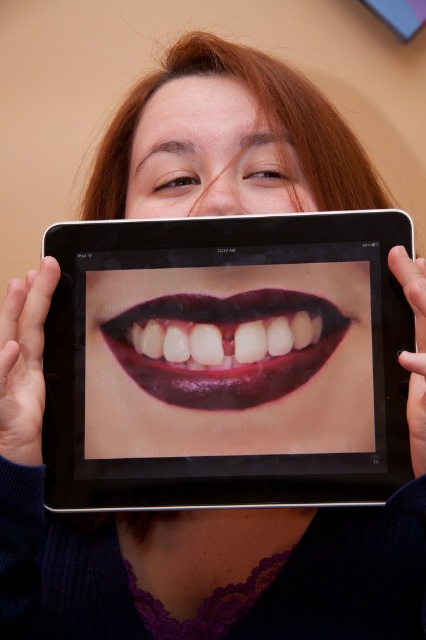
Question: Among these objects, which one is nearest to the camera?

Choices:
 (A) smooth skin at center
 (B) black glossy tablet at center

Answer: (B)

Question: Does shiny dark red lips at center have a lesser width compared to smooth skin at center?

Choices:
 (A) yes
 (B) no

Answer: (A)

Question: Is black glossy tablet at center positioned in front of shiny dark red lips at center?

Choices:
 (A) yes
 (B) no

Answer: (A)

Question: Does black glossy tablet at center come in front of shiny dark red lips at center?

Choices:
 (A) yes
 (B) no

Answer: (A)

Question: Which of the following is the closest to the observer?

Choices:
 (A) smooth skin at center
 (B) black glossy tablet at center
 (C) shiny dark red lips at center

Answer: (B)

Question: Which of the following is the farthest from the observer?

Choices:
 (A) (285, 157)
 (B) (293, 317)
 (C) (215, 273)

Answer: (A)